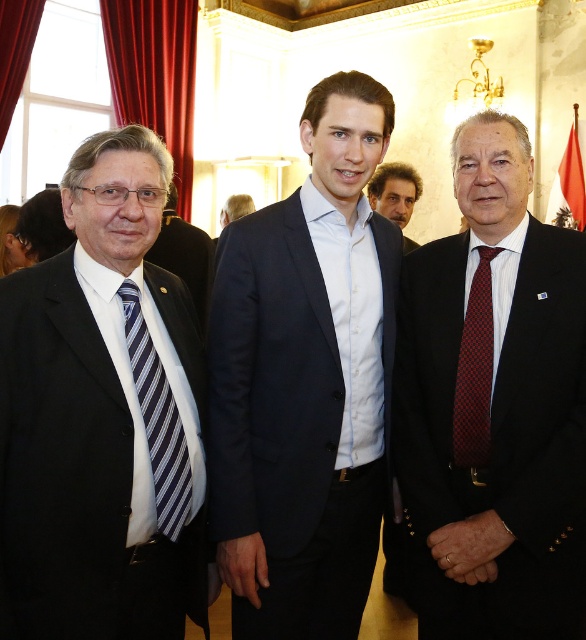
Question: Observing the image, what is the correct spatial positioning of red velvet curtain at left in reference to blue striped tie at left?

Choices:
 (A) right
 (B) left

Answer: (B)

Question: Considering the relative positions of dark blue suit at center and matte black suit at center in the image provided, where is dark blue suit at center located with respect to matte black suit at center?

Choices:
 (A) right
 (B) left

Answer: (A)

Question: Which of the following is the closest to the observer?

Choices:
 (A) (173, 436)
 (B) (209, 284)
 (C) (410, 166)
 (D) (479, 432)

Answer: (A)

Question: From the image, what is the correct spatial relationship of red dotted tie at right in relation to dark brown hair at center?

Choices:
 (A) below
 (B) above

Answer: (A)

Question: Which of these objects is positioned farthest from the matte black suit at center?

Choices:
 (A) dark brown hair at center
 (B) dark blue suit at center
 (C) blue striped tie at left
 (D) navy blue suit at center

Answer: (C)

Question: Which of the following is the farthest from the observer?

Choices:
 (A) pyautogui.click(x=178, y=522)
 (B) pyautogui.click(x=372, y=177)

Answer: (B)